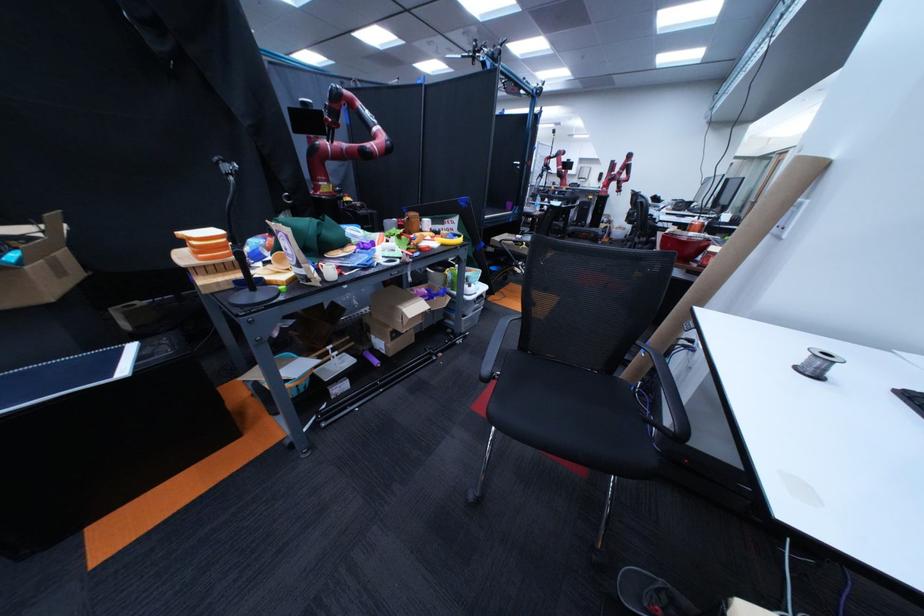
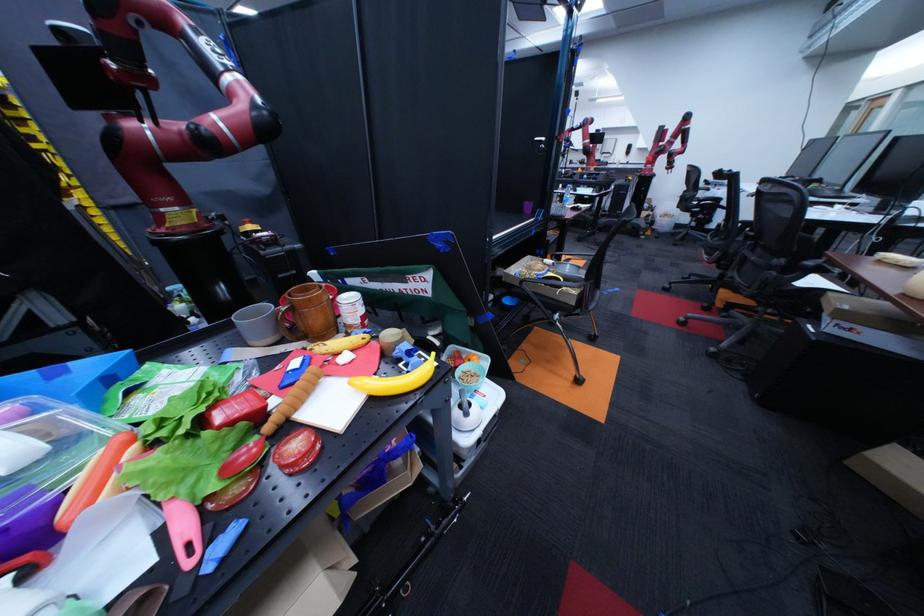
Question: What movement of the cameraman would produce the second image?

Choices:
 (A) Left
 (B) Right
 (C) Forward
 (D) Backward

Answer: (C)